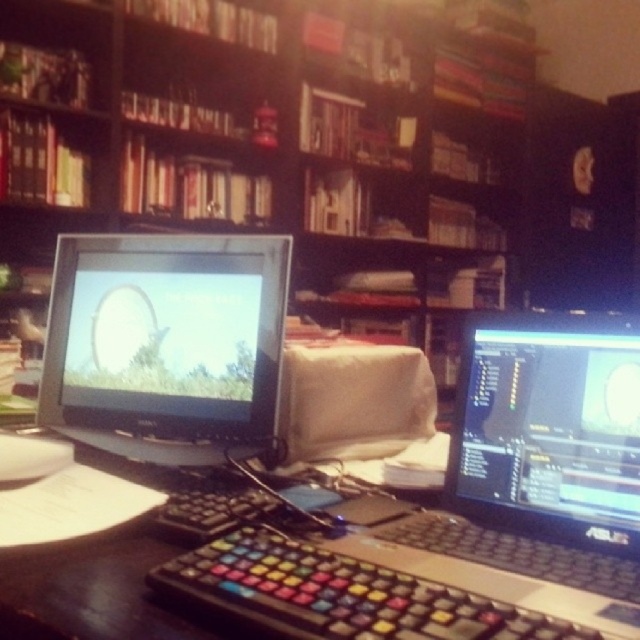
Does point (54, 35) lie behind point (595, 451)?

Yes, point (54, 35) is farther from viewer.

Where is `wooden bookshelf at upper center`? Image resolution: width=640 pixels, height=640 pixels. wooden bookshelf at upper center is located at coordinates (275, 147).

Identify the location of wooden bookshelf at upper center. This screenshot has width=640, height=640. (275, 147).

Who is higher up, black plastic laptop at center or black glossy monitor at center?

black glossy monitor at center

Does point (547, 337) come behind point (477, 488)?

No, it is in front of (477, 488).

Does point (602, 497) come closer to viewer compared to point (477, 468)?

Yes, it is in front of point (477, 468).

Where is `black plastic laptop at center`? The width and height of the screenshot is (640, 640). black plastic laptop at center is located at coordinates tap(538, 472).

Can you confirm if wooden bookshelf at upper center is taller than matte black monitor at center?

Yes, wooden bookshelf at upper center is taller than matte black monitor at center.

Does wooden bookshelf at upper center appear over matte black monitor at center?

Yes.

Who is more distant from viewer, (458,51) or (204,323)?

Point (458,51)

The image size is (640, 640). I want to click on wooden bookshelf at upper center, so click(275, 147).